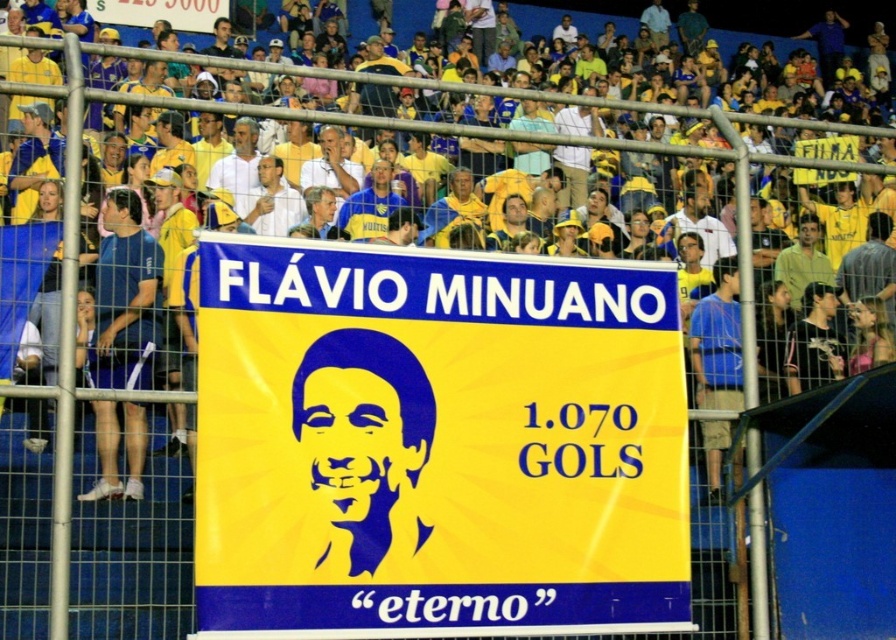
You are a photographer standing in the stadium and want to take a photo of both the yellow fabric banner at center and the blue jersey at center. Which object should you focus on first to ensure both are in clear view?

The yellow fabric banner at center is closer to the viewer than the blue jersey at center, so you should focus on the yellow fabric banner at center first to ensure both are in clear view.

You are a photographer at the stadium and want to capture both the yellow fabric banner at center and the blue jersey at center in a single shot. Based on their positions, which one should be placed in the lower part of your photo?

The yellow fabric banner at center should be placed in the lower part of your photo because it is positioned below the blue jersey at center in the scene.

You are a photographer at the stadium and want to capture both the blue fabric shirt at right and the light blue shirt at center in a single photo. Which shirt should you position closer to the camera to ensure both are clearly visible?

The blue fabric shirt at right is larger in size than the light blue shirt at center. To ensure both are clearly visible, you should position the smaller light blue shirt at center closer to the camera.